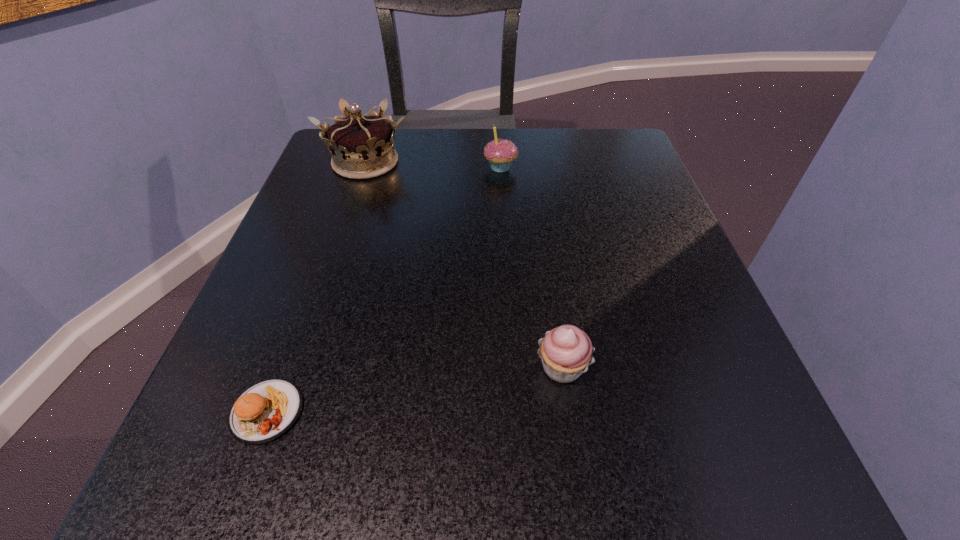
At what (x,y) coordinates should I click in order to perform the action: click on vacant region at the far left corner of the desktop. Please return your answer as a coordinate pair (x, y). Looking at the image, I should click on (324, 155).

This screenshot has width=960, height=540. In order to click on free space at the far right corner of the desktop in this screenshot , I will do `click(590, 155)`.

At what (x,y) coordinates should I click in order to perform the action: click on free space at the near right corner of the desktop. Please return your answer as a coordinate pair (x, y). The width and height of the screenshot is (960, 540). Looking at the image, I should click on (740, 499).

Find the location of a particular element. This screenshot has height=540, width=960. vacant space that's between the patty and the farther cupcake is located at coordinates (384, 289).

I want to click on unoccupied position between the tallest object and the taller cupcake, so click(x=433, y=165).

What are the coordinates of `vacant space in between the patty and the nearer cupcake` in the screenshot? It's located at (415, 389).

You are a GUI agent. You are given a task and a screenshot of the screen. Output one action in this format:
    pyautogui.click(x=<x>, y=<y>)
    Task: Click on the free space between the shortest object and the taller cupcake
    
    Given the screenshot: What is the action you would take?
    pyautogui.click(x=384, y=289)

You are a GUI agent. You are given a task and a screenshot of the screen. Output one action in this format:
    pyautogui.click(x=<x>, y=<y>)
    Task: Click on the free area in between the shortest object and the farther cupcake
    
    Given the screenshot: What is the action you would take?
    point(384,289)

Find the location of a particular element. The image size is (960, 540). vacant space in between the shortest object and the taller cupcake is located at coordinates (384, 289).

At what (x,y) coordinates should I click in order to perform the action: click on vacant space that's between the patty and the second tallest object. Please return your answer as a coordinate pair (x, y). Looking at the image, I should click on (384, 289).